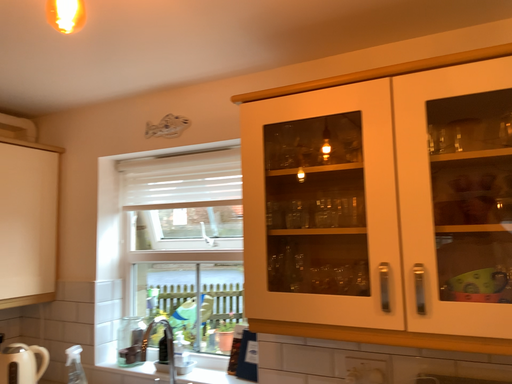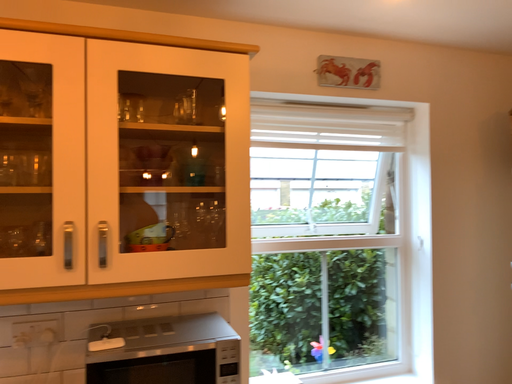
Question: How did the camera likely rotate when shooting the video?

Choices:
 (A) rotated right
 (B) rotated left

Answer: (A)